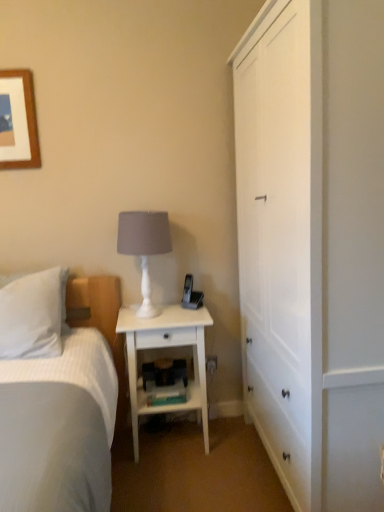
Question: Are white plastic electric outlet at lower center and white wood nightstand at center beside each other?

Choices:
 (A) yes
 (B) no

Answer: (B)

Question: From the image's perspective, is white plastic electric outlet at lower center located beneath white wood nightstand at center?

Choices:
 (A) no
 (B) yes

Answer: (B)

Question: From a real-world perspective, is white plastic electric outlet at lower center positioned under white wood nightstand at center based on gravity?

Choices:
 (A) no
 (B) yes

Answer: (B)

Question: Is white plastic electric outlet at lower center outside of white wood nightstand at center?

Choices:
 (A) no
 (B) yes

Answer: (B)

Question: Is white plastic electric outlet at lower center shorter than white wood nightstand at center?

Choices:
 (A) yes
 (B) no

Answer: (A)

Question: Based on their positions, is white soft pillow at left located to the left or right of white matte table lamp at center?

Choices:
 (A) left
 (B) right

Answer: (A)

Question: Looking at the image, does white soft pillow at left seem bigger or smaller compared to white matte table lamp at center?

Choices:
 (A) small
 (B) big

Answer: (B)

Question: Is white soft pillow at left in front of or behind white matte table lamp at center in the image?

Choices:
 (A) behind
 (B) front

Answer: (B)

Question: Considering the positions of point (56, 354) and point (142, 313), is point (56, 354) closer or farther from the camera than point (142, 313)?

Choices:
 (A) farther
 (B) closer

Answer: (B)

Question: Considering their positions, is white wood cabinet at right located in front of or behind white matte table lamp at center?

Choices:
 (A) front
 (B) behind

Answer: (A)

Question: Looking at their shapes, would you say white wood cabinet at right is wider or thinner than white matte table lamp at center?

Choices:
 (A) wide
 (B) thin

Answer: (A)

Question: From the image's perspective, relative to white matte table lamp at center, is white wood cabinet at right above or below?

Choices:
 (A) above
 (B) below

Answer: (A)

Question: Is point (375, 59) closer or farther from the camera than point (142, 288)?

Choices:
 (A) closer
 (B) farther

Answer: (A)

Question: Considering the positions of white plastic electric outlet at lower center and white matte table lamp at center in the image, is white plastic electric outlet at lower center bigger or smaller than white matte table lamp at center?

Choices:
 (A) small
 (B) big

Answer: (A)

Question: Considering the positions of white plastic electric outlet at lower center and white matte table lamp at center in the image, is white plastic electric outlet at lower center taller or shorter than white matte table lamp at center?

Choices:
 (A) short
 (B) tall

Answer: (A)